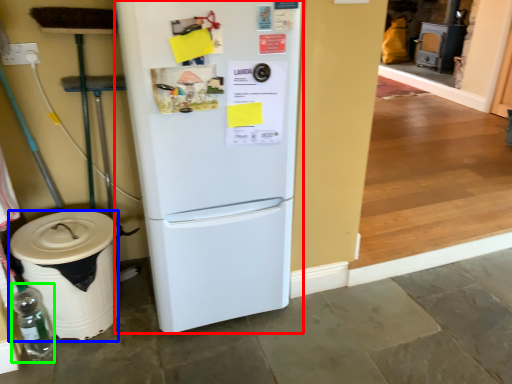
Question: Which is farther away from refrigerator (highlighted by a red box)? trash bin/can (highlighted by a blue box) or bottle (highlighted by a green box)?

Choices:
 (A) trash bin/can
 (B) bottle

Answer: (B)